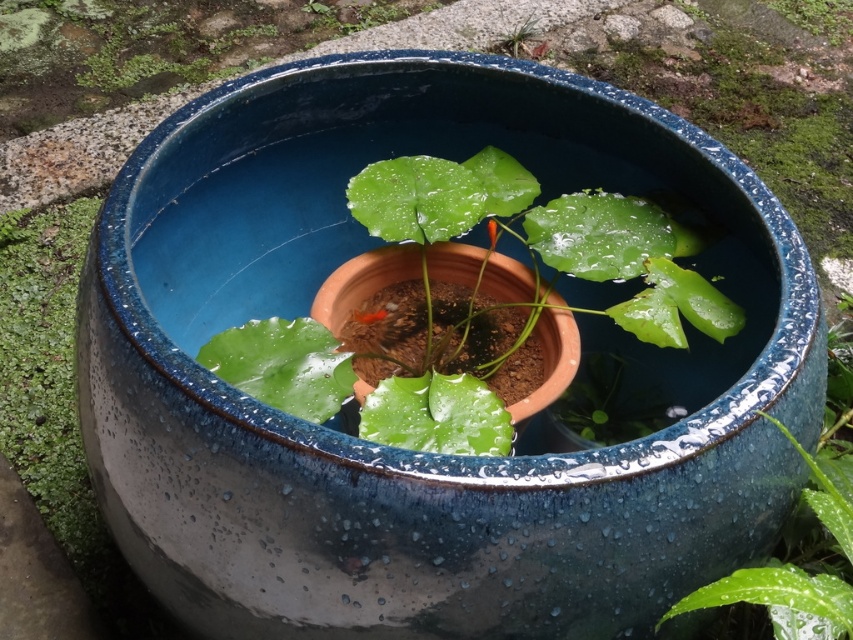
Does point (489, 173) come closer to viewer compared to point (518, 38)?

That is True.

Is point (575, 212) behind point (517, 51)?

No, (575, 212) is closer to viewer.

Which is in front, point (595, 248) or point (531, 29)?

Point (595, 248) is more forward.

Locate an element on the screen. This screenshot has height=640, width=853. green glossy leaves at center is located at coordinates (465, 305).

Does glossy green leaf at lower right have a smaller size compared to green glossy leaf at upper center?

No, glossy green leaf at lower right is not smaller than green glossy leaf at upper center.

Can you confirm if glossy green leaf at lower right is positioned below green glossy leaf at upper center?

Indeed, glossy green leaf at lower right is positioned under green glossy leaf at upper center.

Is point (825, 509) positioned in front of point (811, 10)?

Yes.

Where is `glossy green leaf at lower right`? The height and width of the screenshot is (640, 853). glossy green leaf at lower right is located at coordinates (805, 528).

Does green glossy leaf at upper center have a smaller size compared to green matte plant at upper center?

Incorrect, green glossy leaf at upper center is not smaller in size than green matte plant at upper center.

Can you confirm if green glossy leaf at upper center is shorter than green matte plant at upper center?

In fact, green glossy leaf at upper center may be taller than green matte plant at upper center.

Which is in front, point (820, 8) or point (514, 28)?

Point (514, 28)

The height and width of the screenshot is (640, 853). What are the coordinates of `green glossy leaf at upper center` in the screenshot? It's located at (817, 17).